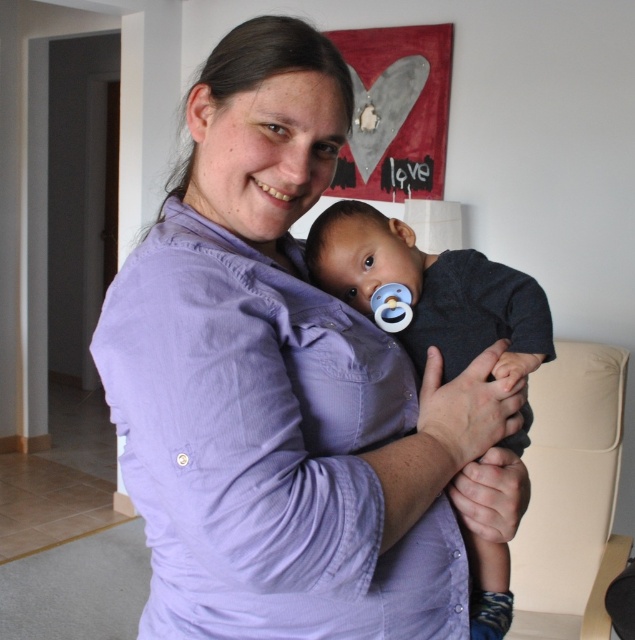
You are a photographer planning to take a portrait of the purple cotton shirt at center and the dark blue fabric baby at center. To ensure both subjects are fully visible in the frame, which subject should you adjust the camera focus to prioritize based on their sizes?

The purple cotton shirt at center is wider than the dark blue fabric baby at center, so you should prioritize focusing on the purple cotton shirt at center to ensure both fit within the frame.

You are a photographer adjusting your camera settings. You notice two points in the scene labeled as point (178, 388) and point (464, 296). Which point should you focus on to ensure it appears sharp in the final photograph if you want the closest object to the camera to be in focus?

You should focus on point (178, 388) because it is closer to the camera than point (464, 296), so it will appear sharp when in focus.

You are a photographer setting up for a family photo. You have a purple cotton shirt at center and a dark blue fabric baby at center in your frame. Which object takes up more space in the photo?

The purple cotton shirt at center is larger in size than the dark blue fabric baby at center, so it takes up more space in the photo.